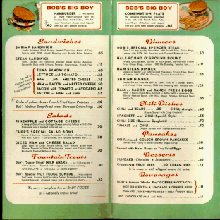
I want to click on picture, so click(x=205, y=19), click(x=13, y=31).